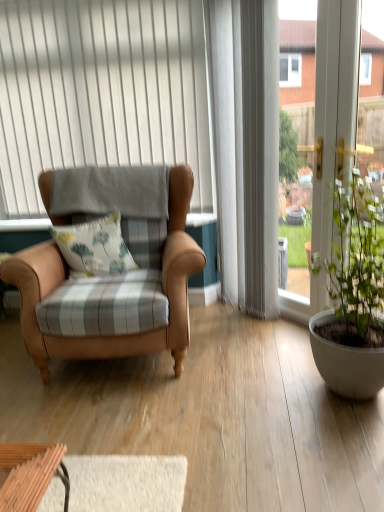
What do you see at coordinates (352, 295) in the screenshot? Image resolution: width=384 pixels, height=512 pixels. I see `matte white pot at right` at bounding box center [352, 295].

What do you see at coordinates (94, 246) in the screenshot?
I see `floral fabric cushion at center` at bounding box center [94, 246].

The image size is (384, 512). What are the coordinates of `white plastic window frame at right` in the screenshot? It's located at (334, 106).

Between point (330, 266) and point (186, 67), which one is positioned behind?

The point (186, 67) is behind.

Would you say matte white pot at right is a long distance from white textured curtain at upper center?

That's right, there is a large distance between matte white pot at right and white textured curtain at upper center.

Between matte white pot at right and white textured curtain at upper center, which one has less height?

matte white pot at right.

Which object is positioned more to the left, matte white pot at right or white textured curtain at upper center?

Positioned to the left is white textured curtain at upper center.

Is matte white pot at right inside white plastic window frame at right?

Actually, matte white pot at right is outside white plastic window frame at right.

Does white plastic window frame at right appear on the right side of matte white pot at right?

Yes, white plastic window frame at right is to the right of matte white pot at right.

How different are the orientations of white plastic window frame at right and matte white pot at right in degrees?

white plastic window frame at right and matte white pot at right are facing 3.46 degrees away from each other.

How distant is leather armchair at left from matte white pot at right?

leather armchair at left is 34.11 inches away from matte white pot at right.

Considering the relative sizes of leather armchair at left and matte white pot at right in the image provided, is leather armchair at left taller than matte white pot at right?

Yes, leather armchair at left is taller than matte white pot at right.

Between point (59, 279) and point (378, 341), which one is positioned in front?

The point (378, 341) is closer to the camera.

Between leather armchair at left and matte white pot at right, which one appears on the left side from the viewer's perspective?

leather armchair at left.

Is white textured curtain at upper center positioned far away from floral fabric cushion at center?

white textured curtain at upper center is actually quite close to floral fabric cushion at center.

Relative to floral fabric cushion at center, is white textured curtain at upper center in front or behind?

white textured curtain at upper center is positioned farther from the viewer than floral fabric cushion at center.

Between white textured curtain at upper center and floral fabric cushion at center, which one has larger size?

Bigger between the two is white textured curtain at upper center.

Between white textured curtain at upper center and floral fabric cushion at center, which one has less height?

With less height is floral fabric cushion at center.

Does white textured curtain at upper center come behind white plastic window frame at right?

Yes, white textured curtain at upper center is behind white plastic window frame at right.

Considering the relative sizes of white textured curtain at upper center and white plastic window frame at right in the image provided, is white textured curtain at upper center thinner than white plastic window frame at right?

Yes.

From a real-world perspective, is white textured curtain at upper center positioned above or below white plastic window frame at right?

From a real-world perspective, white textured curtain at upper center is physically above white plastic window frame at right.

The width and height of the screenshot is (384, 512). Find the location of `curtain above the white plastic window frame at right (from a real-world perspective)`. curtain above the white plastic window frame at right (from a real-world perspective) is located at coordinates (102, 92).

Can you tell me how much leather armchair at left and white textured curtain at upper center differ in facing direction?

They differ by 0.302 degrees in their facing directions.

Can you confirm if leather armchair at left is smaller than white textured curtain at upper center?

No.

Is leather armchair at left wider or thinner than white textured curtain at upper center?

leather armchair at left is wider than white textured curtain at upper center.

Is point (38, 248) positioned after point (20, 98)?

No.

Find the location of a particular element. chair located below the white plastic window frame at right (from the image's perspective) is located at coordinates (120, 337).

From a real-world perspective, is white plastic window frame at right physically located above or below leather armchair at left?

white plastic window frame at right is situated higher than leather armchair at left in the real world.

Relative to leather armchair at left, is white plastic window frame at right in front or behind?

In the image, white plastic window frame at right appears behind leather armchair at left.

From the image's perspective, which one is positioned lower, white plastic window frame at right or leather armchair at left?

leather armchair at left is shown below in the image.

Identify the location of houseplant on the right of the white textured curtain at upper center. The width and height of the screenshot is (384, 512). (352, 295).

Image resolution: width=384 pixels, height=512 pixels. In order to click on houseplant on the left of the white plastic window frame at right in this screenshot , I will do `click(352, 295)`.

Which object lies further to the anchor point white textured curtain at upper center, leather armchair at left or matte white pot at right?

Among the two, matte white pot at right is located further to white textured curtain at upper center.

Considering their positions, is floral fabric cushion at center positioned further to white plastic window frame at right than matte white pot at right?

floral fabric cushion at center lies further to white plastic window frame at right than the other object.

From the image, which object appears to be farther from floral fabric cushion at center, leather armchair at left or white plastic window frame at right?

Based on the image, white plastic window frame at right appears to be further to floral fabric cushion at center.

When comparing their distances from leather armchair at left, does floral fabric cushion at center or white plastic window frame at right seem further?

white plastic window frame at right is positioned further to the anchor leather armchair at left.

Which object lies further to the anchor point matte white pot at right, floral fabric cushion at center or white textured curtain at upper center?

white textured curtain at upper center.

Looking at the image, which one is located closer to white plastic window frame at right, floral fabric cushion at center or white textured curtain at upper center?

floral fabric cushion at center lies closer to white plastic window frame at right than the other object.

Looking at this image, considering their positions, is white plastic window frame at right positioned closer to leather armchair at left than floral fabric cushion at center?

Based on the image, floral fabric cushion at center appears to be nearer to leather armchair at left.

Considering their positions, is white plastic window frame at right positioned further to white textured curtain at upper center than matte white pot at right?

Based on the image, matte white pot at right appears to be further to white textured curtain at upper center.

This screenshot has width=384, height=512. In order to click on houseplant located between white textured curtain at upper center and white plastic window frame at right in the left-right direction in this screenshot , I will do `click(352, 295)`.

The image size is (384, 512). Identify the location of pillow between white textured curtain at upper center and white plastic window frame at right. (94, 246).

Locate an element on the screen. This screenshot has height=512, width=384. pillow situated between white textured curtain at upper center and matte white pot at right from left to right is located at coordinates (94, 246).

In order to click on houseplant located between leather armchair at left and white plastic window frame at right in the left-right direction in this screenshot , I will do `click(352, 295)`.